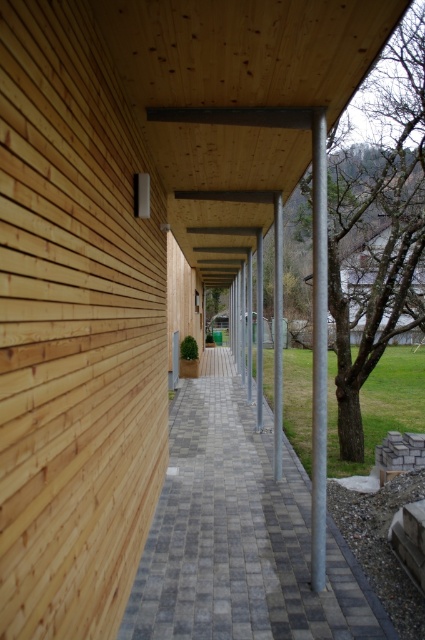
Describe the element at coordinates (238, 534) in the screenshot. I see `gray checkered paving at center` at that location.

Which of these two, gray checkered paving at center or galvanized metal pole at center, stands shorter?

With less height is gray checkered paving at center.

The image size is (425, 640). I want to click on gray checkered paving at center, so click(238, 534).

The height and width of the screenshot is (640, 425). I want to click on gray checkered paving at center, so click(238, 534).